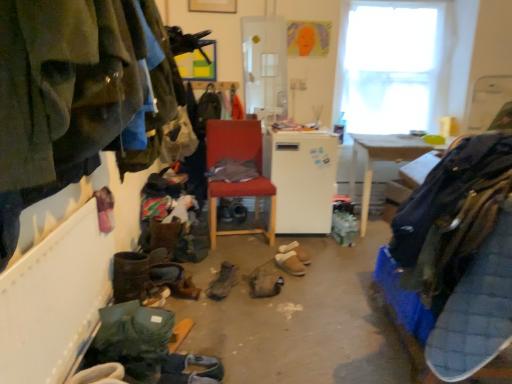
The image size is (512, 384). Describe the element at coordinates (134, 274) in the screenshot. I see `leather boots at lower center, the fifth footwear from the back` at that location.

Where is `dark blue fabric at right, placed as the second clothing when sorted from left to right`? This screenshot has height=384, width=512. dark blue fabric at right, placed as the second clothing when sorted from left to right is located at coordinates (451, 215).

What is the approximate height of brown suede sandals at center, which is the sixth footwear from front to back?

brown suede sandals at center, which is the sixth footwear from front to back, is 5.41 inches tall.

Image resolution: width=512 pixels, height=384 pixels. What do you see at coordinates (296, 252) in the screenshot? I see `brown suede sandals at center, which is the sixth footwear from front to back` at bounding box center [296, 252].

Where is `transparent glass window at upper right`? The width and height of the screenshot is (512, 384). transparent glass window at upper right is located at coordinates (394, 65).

What do you see at coordinates (381, 160) in the screenshot?
I see `wooden table at right` at bounding box center [381, 160].

Find the location of a particular element. The width and height of the screenshot is (512, 384). leather boot at center, which is the fourth footwear from front to back is located at coordinates (264, 283).

Considering their positions, is green suede jacket at left, which is the 2th clothing in right-to-left order, located in front of or behind transparent glass window at upper right?

In the image, green suede jacket at left, which is the 2th clothing in right-to-left order, appears in front of transparent glass window at upper right.

From a real-world perspective, who is located higher, green suede jacket at left, which is the 2th clothing in right-to-left order, or transparent glass window at upper right?

In real-world perspective, transparent glass window at upper right is above.

Looking at their sizes, would you say green suede jacket at left, which is the 2th clothing in right-to-left order, is wider or thinner than transparent glass window at upper right?

green suede jacket at left, which is the 2th clothing in right-to-left order, is wider than transparent glass window at upper right.

Is green suede jacket at left, the first clothing from the left, bigger than transparent glass window at upper right?

No.

Is dark gray suede shoes at lower center, the sixth footwear positioned from the back, at the back of transparent glass window at upper right?

No, dark gray suede shoes at lower center, the sixth footwear positioned from the back, is not at the back of transparent glass window at upper right.

How many degrees apart are the facing directions of transparent glass window at upper right and dark gray suede shoes at lower center, the sixth footwear positioned from the back?

The angular difference between transparent glass window at upper right and dark gray suede shoes at lower center, the sixth footwear positioned from the back, is 70.1 degrees.

Is transparent glass window at upper right further to camera compared to dark gray suede shoes at lower center, the sixth footwear positioned from the back?

Yes, it is behind dark gray suede shoes at lower center, the sixth footwear positioned from the back.

Are transparent glass window at upper right and dark gray suede shoes at lower center, the sixth footwear positioned from the back, located far from each other?

Absolutely, transparent glass window at upper right is distant from dark gray suede shoes at lower center, the sixth footwear positioned from the back.

Looking at this image, is wooden table at right positioned beyond the bounds of leather boots at lower center, which appears as the 2th footwear when viewed from the front?

Absolutely, wooden table at right is external to leather boots at lower center, which appears as the 2th footwear when viewed from the front.

Is point (369, 136) positioned behind point (145, 269)?

Yes, it is.

Considering the relative positions of wooden table at right and leather boots at lower center, the fifth footwear from the back, in the image provided, is wooden table at right to the left of leather boots at lower center, the fifth footwear from the back, from the viewer's perspective?

Incorrect, wooden table at right is not on the left side of leather boots at lower center, the fifth footwear from the back.

From the image's perspective, is wooden table at right beneath leather boots at lower center, the fifth footwear from the back?

No, from the image's perspective, wooden table at right is not below leather boots at lower center, the fifth footwear from the back.

Would you say white matte refrigerator at center is to the left or to the right of transparent glass window at upper right in the picture?

Based on their positions, white matte refrigerator at center is located to the left of transparent glass window at upper right.

Which is less distant, (324, 175) or (382, 2)?

Point (324, 175) is positioned closer to the camera compared to point (382, 2).

In the scene shown: From their relative heights in the image, would you say white matte refrigerator at center is taller or shorter than transparent glass window at upper right?

white matte refrigerator at center is shorter than transparent glass window at upper right.

In terms of size, does leather boots at lower center, the fifth footwear from the back, appear bigger or smaller than leather boot at center, which is the fourth footwear from front to back?

leather boots at lower center, the fifth footwear from the back, is bigger than leather boot at center, which is the fourth footwear from front to back.

Does leather boots at lower center, which appears as the 2th footwear when viewed from the front, turn towards leather boot at center, arranged as the 3th footwear when viewed from the back?

No, leather boots at lower center, which appears as the 2th footwear when viewed from the front, does not turn towards leather boot at center, arranged as the 3th footwear when viewed from the back.

Is point (116, 254) behind point (265, 285)?

No.

Is leather boots at lower center, which appears as the 2th footwear when viewed from the front, completely or partially outside of leather boot at center, which is the fourth footwear from front to back?

Yes, leather boots at lower center, which appears as the 2th footwear when viewed from the front, is outside of leather boot at center, which is the fourth footwear from front to back.

Who is smaller, dark gray suede shoes at lower center, the sixth footwear positioned from the back, or green suede jacket at left, the first clothing from the left?

dark gray suede shoes at lower center, the sixth footwear positioned from the back, is smaller.

Is dark gray suede shoes at lower center, arranged as the 1th footwear when viewed from the front, far from green suede jacket at left, the first clothing from the left?

Yes.

From the image's perspective, which object appears higher, dark gray suede shoes at lower center, arranged as the 1th footwear when viewed from the front, or green suede jacket at left, the first clothing from the left?

From the image's view, green suede jacket at left, the first clothing from the left, is above.

What's the angular difference between matte red chair at center and brown suede sandals at center, which is the sixth footwear from front to back,'s facing directions?

The angle between the facing direction of matte red chair at center and the facing direction of brown suede sandals at center, which is the sixth footwear from front to back, is 27.8 degrees.

Is matte red chair at center not near brown suede sandals at center, the first footwear in the back-to-front sequence?

No, matte red chair at center is not far away from brown suede sandals at center, the first footwear in the back-to-front sequence.

Which object is closer to the camera taking this photo, matte red chair at center or brown suede sandals at center, which is the sixth footwear from front to back?

brown suede sandals at center, which is the sixth footwear from front to back, is closer to the camera.

Considering the sizes of objects matte red chair at center and brown suede sandals at center, the first footwear in the back-to-front sequence, in the image provided, who is shorter, matte red chair at center or brown suede sandals at center, the first footwear in the back-to-front sequence,?

With less height is brown suede sandals at center, the first footwear in the back-to-front sequence.

The height and width of the screenshot is (384, 512). Find the location of `window behind the green suede jacket at left, which is the 2th clothing in right-to-left order`. window behind the green suede jacket at left, which is the 2th clothing in right-to-left order is located at coordinates (394, 65).

From the image's perspective, starting from the transparent glass window at upper right, which footwear is the 6th one below? Please provide its 2D coordinates.

[(191, 373)]

When comparing their distances from leather boots at center, marked as the third footwear in a front-to-back arrangement, does green suede jacket at left, the first clothing from the left, or white matte refrigerator at center seem further?

Based on the image, green suede jacket at left, the first clothing from the left, appears to be further to leather boots at center, marked as the third footwear in a front-to-back arrangement.

Looking at this image, when comparing their distances from wooden table at right, does transparent glass window at upper right or brown suede sandals at center, the first footwear in the back-to-front sequence, seem closer?

transparent glass window at upper right is closer to wooden table at right.

When comparing their distances from brown suede shoes at center, the 2th footwear when ordered from back to front, does wooden table at right or dark blue fabric at right, placed as the second clothing when sorted from left to right, seem closer?

Based on the image, wooden table at right appears to be nearer to brown suede shoes at center, the 2th footwear when ordered from back to front.

From the image, which object appears to be farther from leather boots at lower center, which appears as the 2th footwear when viewed from the front, dark gray suede shoes at lower center, arranged as the 1th footwear when viewed from the front, or transparent glass window at upper right?

transparent glass window at upper right.

Estimate the real-world distances between objects in this image. Which object is closer to transparent glass window at upper right, leather boots at lower center, the fifth footwear from the back, or leather boots at center, which ranks as the fourth footwear in back-to-front order?

leather boots at center, which ranks as the fourth footwear in back-to-front order.

Which object lies nearer to the anchor point leather boot at center, arranged as the 3th footwear when viewed from the back, dark blue fabric at right, which appears as the first clothing when viewed from the right, or leather boots at center, marked as the third footwear in a front-to-back arrangement?

Among the two, leather boots at center, marked as the third footwear in a front-to-back arrangement, is located nearer to leather boot at center, arranged as the 3th footwear when viewed from the back.

Based on their spatial positions, is green suede jacket at left, the first clothing from the left, or leather boots at center, marked as the third footwear in a front-to-back arrangement, closer to leather boots at lower center, which appears as the 2th footwear when viewed from the front?

leather boots at center, marked as the third footwear in a front-to-back arrangement, lies closer to leather boots at lower center, which appears as the 2th footwear when viewed from the front, than the other object.

Considering their positions, is wooden table at right positioned further to leather boots at center, marked as the third footwear in a front-to-back arrangement, than dark gray suede shoes at lower center, arranged as the 1th footwear when viewed from the front?

Based on the image, wooden table at right appears to be further to leather boots at center, marked as the third footwear in a front-to-back arrangement.

The image size is (512, 384). Find the location of `appliance situated between brown suede sandals at center, the first footwear in the back-to-front sequence, and wooden table at right from left to right`. appliance situated between brown suede sandals at center, the first footwear in the back-to-front sequence, and wooden table at right from left to right is located at coordinates (302, 179).

At what (x,y) coordinates should I click in order to perform the action: click on footwear situated between leather boots at center, which ranks as the fourth footwear in back-to-front order, and brown suede shoes at center, the 2th footwear when ordered from back to front, from left to right. Please return your answer as a coordinate pair (x, y). This screenshot has height=384, width=512. Looking at the image, I should click on (264, 283).

The image size is (512, 384). What are the coordinates of `appliance between dark blue fabric at right, which appears as the first clothing when viewed from the right, and wooden table at right, along the z-axis` in the screenshot? It's located at (302, 179).

Find the location of a particular element. Image resolution: width=512 pixels, height=384 pixels. appliance between transparent glass window at upper right and brown suede shoes at center, the 2th footwear when ordered from back to front, in the up-down direction is located at coordinates [x=302, y=179].